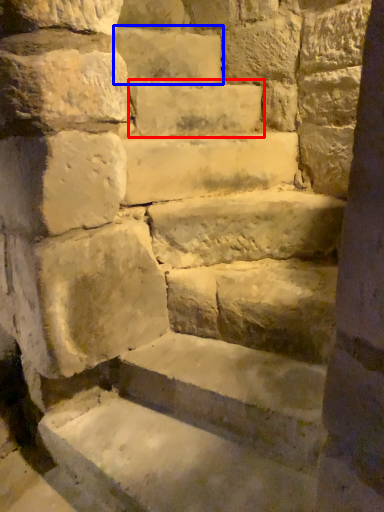
Question: Which point is closer to the camera, brick (highlighted by a red box) or brick (highlighted by a blue box)?

Choices:
 (A) brick
 (B) brick

Answer: (A)